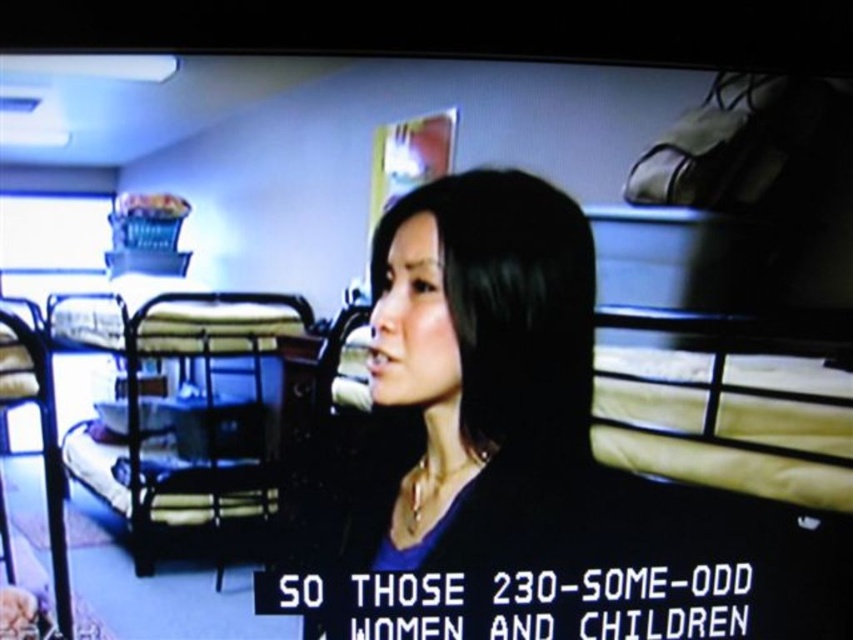
You are a camera operator adjusting your position to film the scene. You need to focus on the black matte hair at center and the metallic silver bunk bed at left. Which object should you adjust your focus to first to ensure both are in frame?

The black matte hair at center should be focused on first since it is closer to the viewer than the metallic silver bunk bed at left, allowing the camera to capture both objects in the frame by adjusting focus from near to far.

You are a photographer standing in front of the scene shown. You want to take a closeup photo of the black matte hair at center. The camera you have can focus on objects within 3 feet. Will you be able to take the photo without moving closer?

The black matte hair at center is 3.53 feet away from viewer. Since the camera can focus within 3 feet, you are too far to take a closeup photo without moving closer.